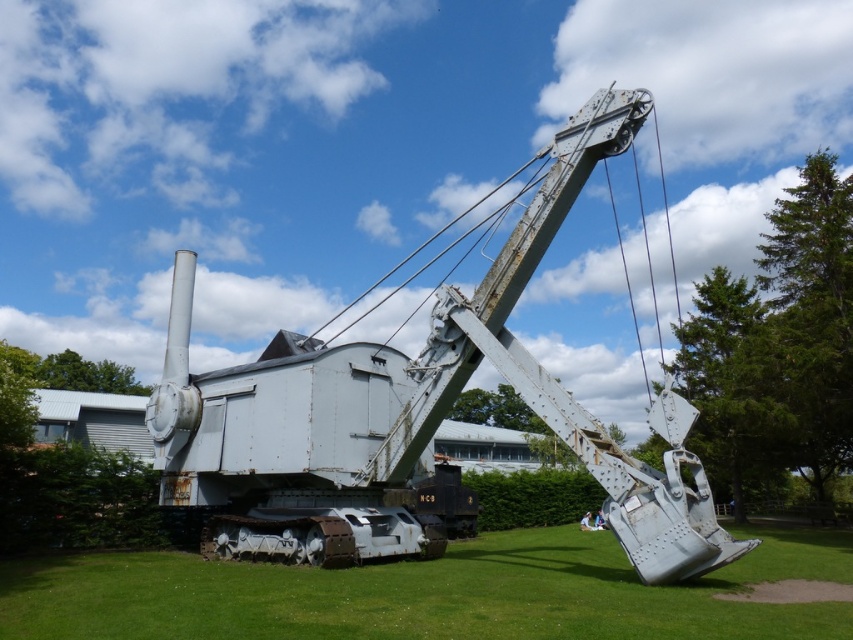
What do you see at coordinates (415, 408) in the screenshot? The image size is (853, 640). I see `rusty metal excavator at center` at bounding box center [415, 408].

Who is higher up, rusty metal excavator at center or green grass at lower center?

rusty metal excavator at center is above.

Is point (154, 397) less distant than point (554, 566)?

No, (154, 397) is further to viewer.

This screenshot has height=640, width=853. I want to click on rusty metal excavator at center, so click(415, 408).